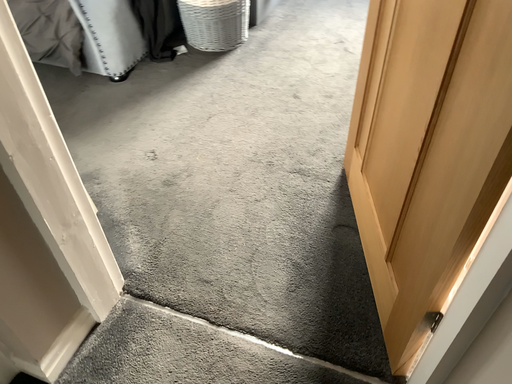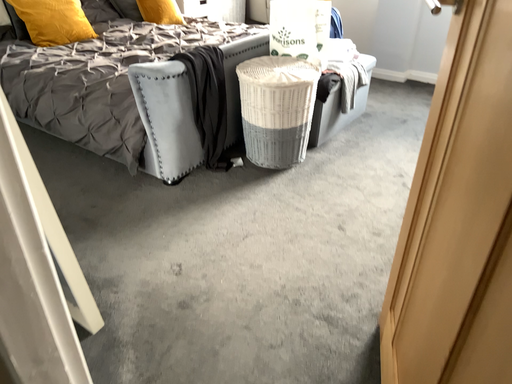
Question: Which way did the camera rotate in the video?

Choices:
 (A) rotated right
 (B) rotated left

Answer: (B)